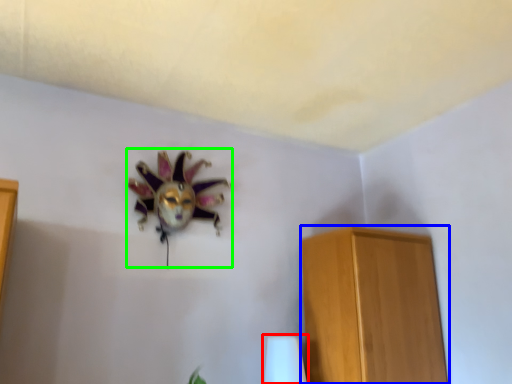
Question: Estimate the real-world distances between objects in this image. Which object is closer to table lamp (highlighted by a red box), furniture (highlighted by a blue box) or animal (highlighted by a green box)?

Choices:
 (A) furniture
 (B) animal

Answer: (A)